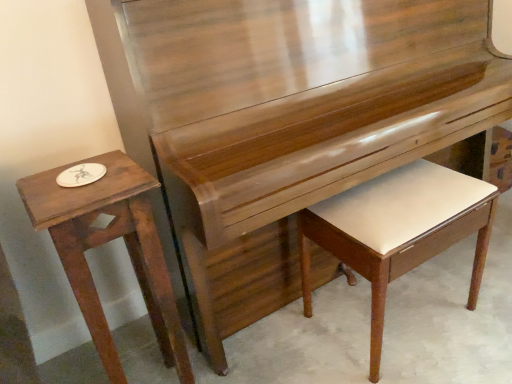
Locate an element on the screen. Image resolution: width=512 pixels, height=384 pixels. free space to the right of white leather music stool at lower right is located at coordinates [475, 295].